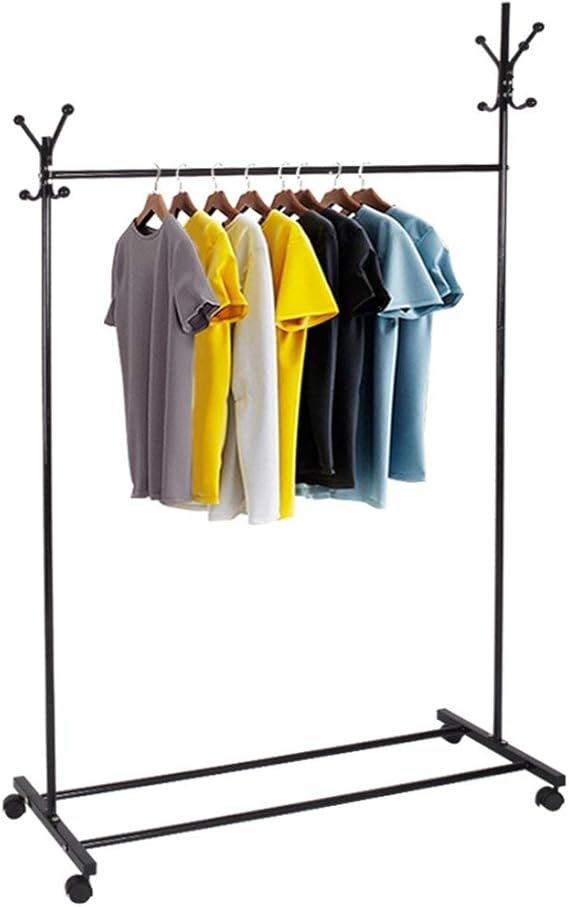
Image resolution: width=569 pixels, height=907 pixels. In order to click on brown clothes hanger in this screenshot , I will do `click(160, 208)`, `click(180, 203)`, `click(215, 201)`, `click(251, 197)`, `click(288, 200)`, `click(308, 198)`, `click(339, 194)`, `click(362, 193)`.